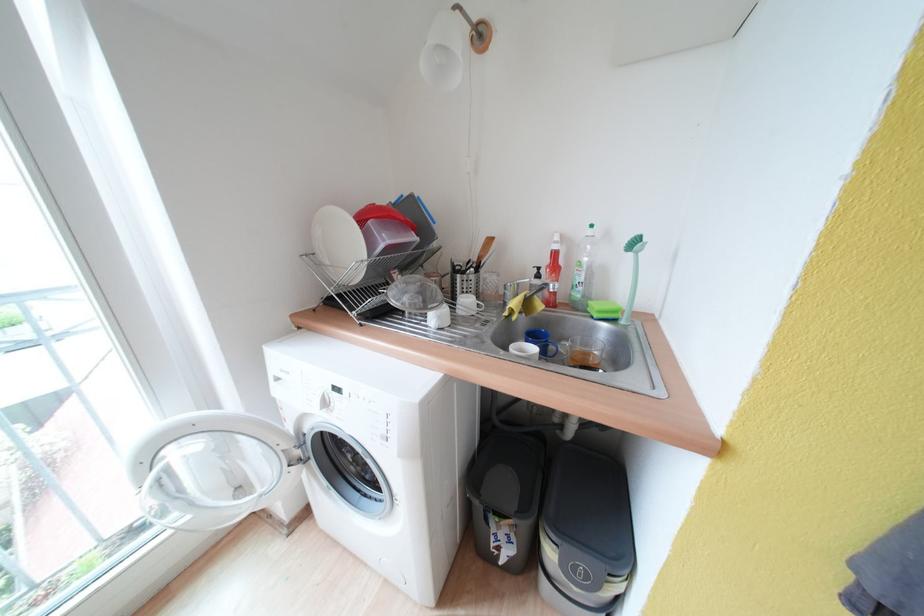
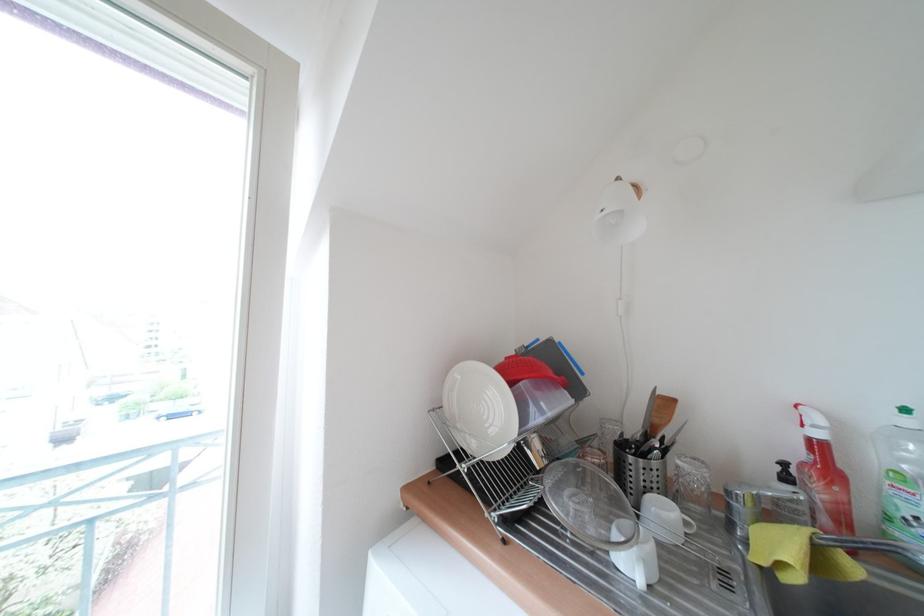
The point at (315, 259) is marked in the first image. Where is the corresponding point in the second image?

(444, 413)